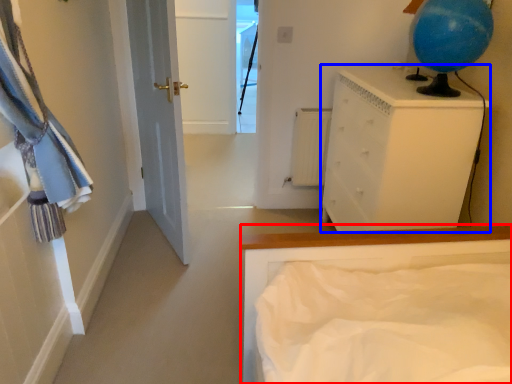
Question: Which object is closer to the camera taking this photo, bed (highlighted by a red box) or chest of drawers (highlighted by a blue box)?

Choices:
 (A) bed
 (B) chest of drawers

Answer: (A)